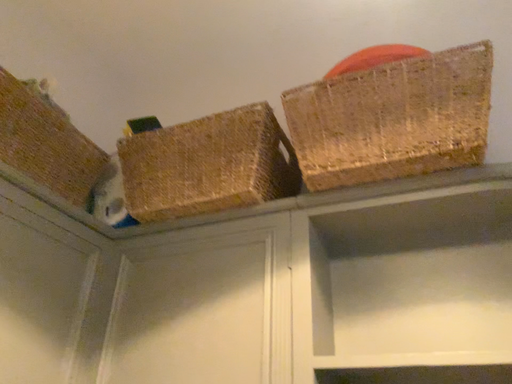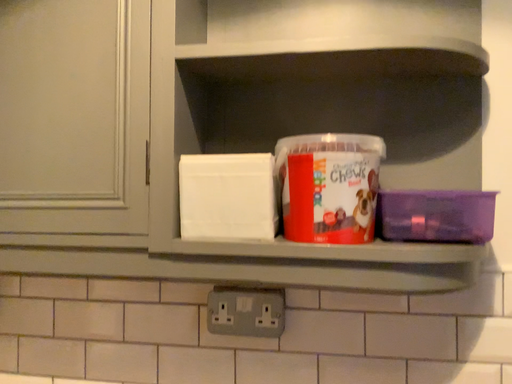
Question: Which way did the camera rotate in the video?

Choices:
 (A) rotated downward
 (B) rotated upward

Answer: (A)